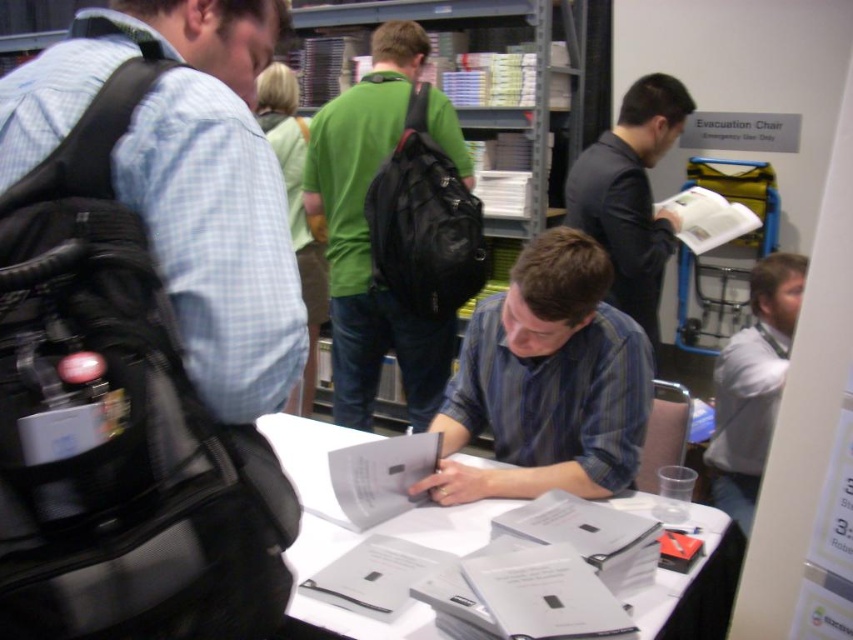
You are a security guard in the library and need to determine if the dark gray suit jacket at upper right is covering the white shirt at right. Can you confirm this?

The dark gray suit jacket at upper right is positioned over the white shirt at right, so yes, it is covering it.

Based on the photo, you are standing at the camera position and want to reach the point marked as point (x=637, y=342). If your walking speed is 1.2 meters per second, how many seconds will it take you to reach that point?

The distance between the camera and point (x=637, y=342) is 1.54 meters. At a speed of 1.2 meters per second, it would take approximately 1.28 seconds to reach the point.